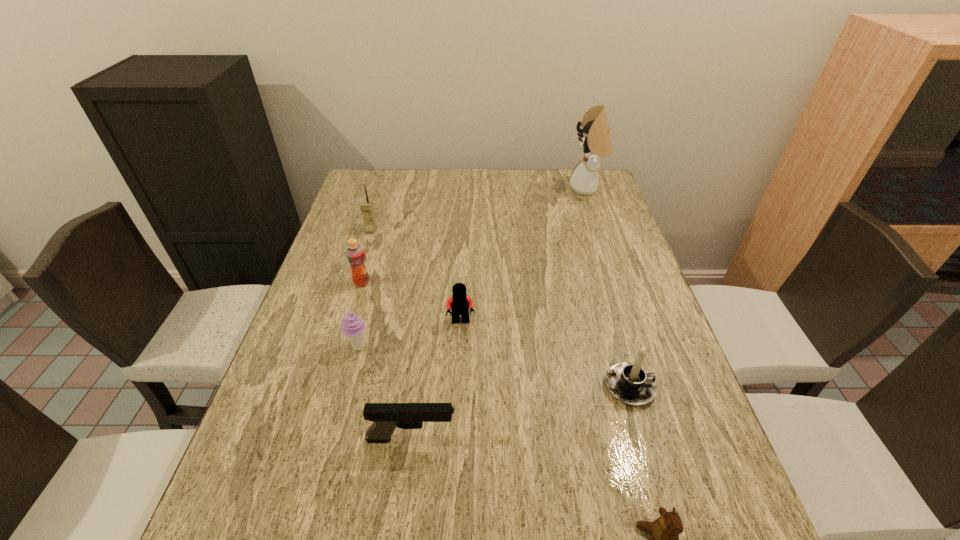
Where is `vacant point located between the Lego and the pistol`? vacant point located between the Lego and the pistol is located at coordinates (436, 380).

I want to click on vacant region between the candle holder and the tallest object, so click(x=609, y=288).

Identify the location of unoccupied area between the fourth nearest object and the seventh farthest object. This screenshot has width=960, height=540. (385, 393).

Where is `the fourth closest object relative to the fifth farthest object`? the fourth closest object relative to the fifth farthest object is located at coordinates (366, 207).

Find the location of a particular element. the closest object relative to the candle holder is located at coordinates (665, 530).

This screenshot has width=960, height=540. I want to click on vacant space that satisfies the following two spatial constraints: 1. on the front of the second farthest object, where the keypad is located; 2. on the right side of the fifth farthest object, so click(334, 347).

The width and height of the screenshot is (960, 540). Identify the location of vacant space that satisfies the following two spatial constraints: 1. at the front face of the tallest object; 2. on the front of the cellular telephone, where the keypad is located. (601, 230).

Where is `vacant space that satisfies the following two spatial constraints: 1. on the front side of the fourth nearest object; 2. on the right side of the orange juice`? This screenshot has width=960, height=540. vacant space that satisfies the following two spatial constraints: 1. on the front side of the fourth nearest object; 2. on the right side of the orange juice is located at coordinates (343, 347).

Identify the location of vacant space that satisfies the following two spatial constraints: 1. at the front face of the farthest object; 2. on the front of the seventh nearest object, where the keypad is located. (601, 230).

You are a GUI agent. You are given a task and a screenshot of the screen. Output one action in this format:
    pyautogui.click(x=<x>, y=<y>)
    Task: Click on the free spot that satisfies the following two spatial constraints: 1. on the front-facing side of the Lego; 2. on the front-facing side of the seventh farthest object
    This screenshot has height=540, width=960.
    Given the screenshot: What is the action you would take?
    pyautogui.click(x=456, y=438)